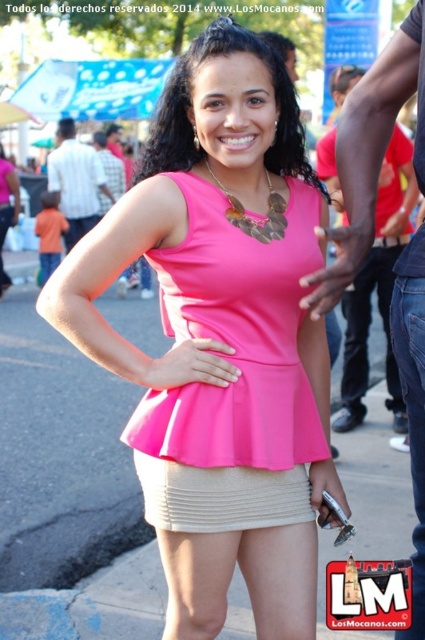
Which is in front, point (305, 438) or point (302, 481)?

Positioned in front is point (302, 481).

Can you confirm if pink matte top at center is wider than beige ribbed miniskirt at center?

Correct, the width of pink matte top at center exceeds that of beige ribbed miniskirt at center.

Who is more forward, (299, 237) or (156, 502)?

Point (156, 502) is more forward.

Where is `pink matte top at center`? pink matte top at center is located at coordinates (221, 328).

The image size is (425, 640). What do you see at coordinates (235, 339) in the screenshot?
I see `pink matte peplum top at center` at bounding box center [235, 339].

What are the coordinates of `pink matte peplum top at center` in the screenshot? It's located at (235, 339).

Locate an element on the screen. This screenshot has height=640, width=425. pink matte peplum top at center is located at coordinates (235, 339).

Is point (249, 381) closer to camera compared to point (209, 403)?

No, it is not.

Who is lower down, pink matte top at center or pink matte peplum top at center?

Positioned lower is pink matte top at center.

This screenshot has width=425, height=640. I want to click on pink matte top at center, so click(221, 328).

Find the location of a particular element. The width and height of the screenshot is (425, 640). pink matte top at center is located at coordinates (221, 328).